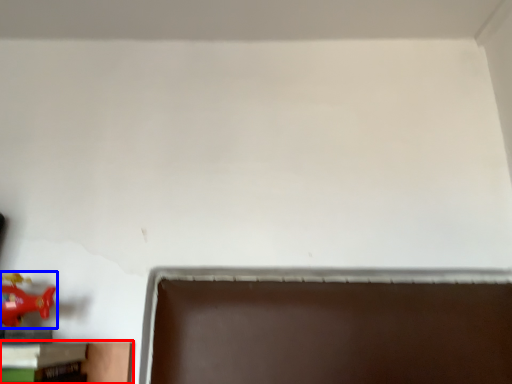
Question: Which object is further to the camera taking this photo, furniture (highlighted by a red box) or toy (highlighted by a blue box)?

Choices:
 (A) furniture
 (B) toy

Answer: (B)